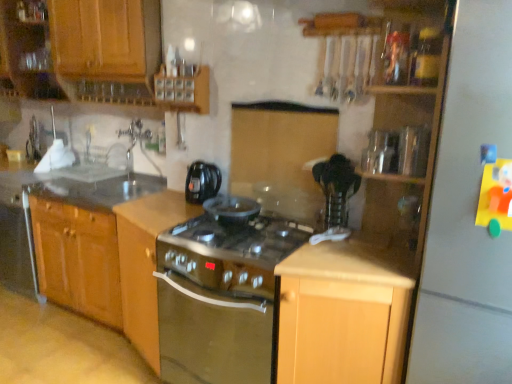
At what (x,y) coordinates should I click in order to perform the action: click on free spot to the left of black plastic kettle at center. Please return your answer as a coordinate pair (x, y). Looking at the image, I should click on (165, 207).